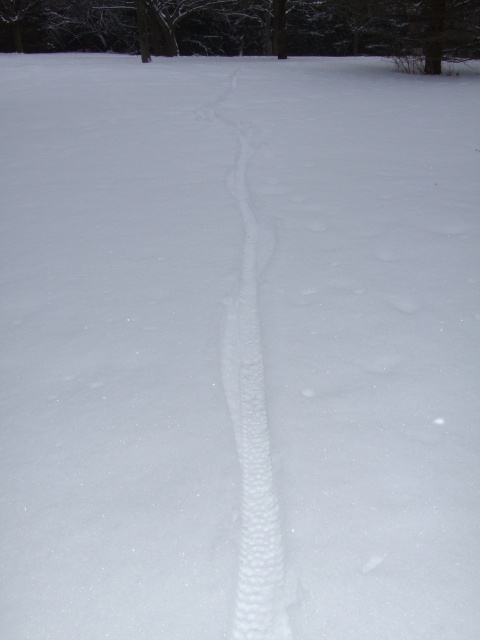
In the scene shown: You are an animal tracker in a snowy area. You see the brown textured tree at upper center and the white textured snow trail at center. Which object is higher in the image?

The brown textured tree at upper center is above the white textured snow trail at center, so the brown textured tree at upper center is higher in the image.

You are an animal tracker analyzing the snowy landscape. You notice the brown textured tree at upper center and the white textured snow trail at center. Which object is positioned to the right of the other?

The brown textured tree at upper center is to the right of the white textured snow trail at center.

You are a wildlife researcher studying animal tracks in a snowy forest. You observe the brown textured tree at upper center and the white textured snow trail at center. Which object is wider in this scene?

The brown textured tree at upper center might be wider than white textured snow trail at center according to the description.